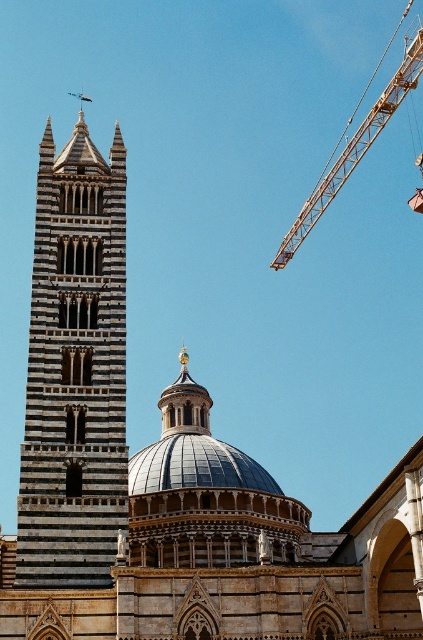
Can you confirm if metallic silver dome at center is positioned to the right of orange metallic crane at upper right?

In fact, metallic silver dome at center is to the left of orange metallic crane at upper right.

The width and height of the screenshot is (423, 640). I want to click on metallic silver dome at center, so 195,467.

Which is in front, point (277, 532) or point (142, 483)?

Point (277, 532)

Is point (216, 596) positioned before point (164, 448)?

Yes, point (216, 596) is in front of point (164, 448).

What do you see at coordinates (235, 552) in the screenshot? This screenshot has width=423, height=640. I see `striped stone dome at center` at bounding box center [235, 552].

Find the location of `striped stone dome at center`. striped stone dome at center is located at coordinates (235, 552).

Which of these two, striped stone tower at left or orange metallic crane at upper right, stands taller?

orange metallic crane at upper right

Where is `striped stone tower at left`? Image resolution: width=423 pixels, height=640 pixels. striped stone tower at left is located at coordinates tap(74, 369).

Is point (74, 188) positioned before point (288, 232)?

Yes, point (74, 188) is in front of point (288, 232).

The image size is (423, 640). What are the coordinates of `striped stone tower at left` in the screenshot? It's located at (74, 369).